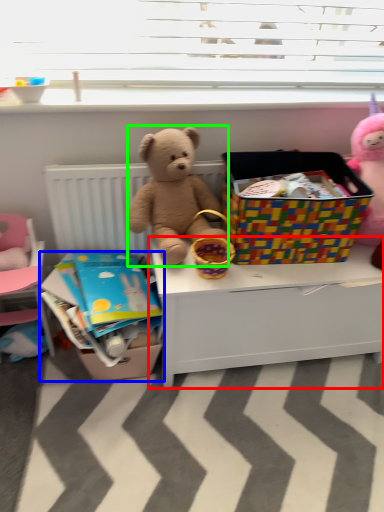
Question: Based on their relative distances, which object is farther from desk (highlighted by a red box)? Choose from crate (highlighted by a blue box) and teddy bear (highlighted by a green box).

Choices:
 (A) crate
 (B) teddy bear

Answer: (A)